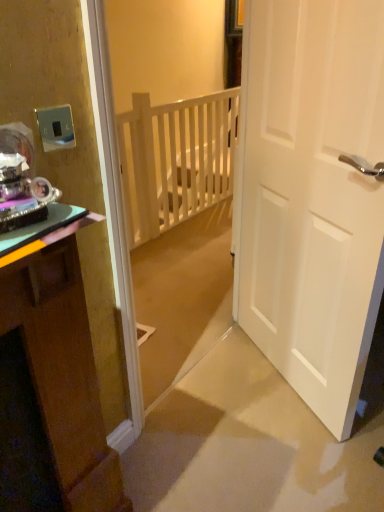
Question: Should I look upward or downward to see white wooden balustrade at center?

Choices:
 (A) down
 (B) up

Answer: (B)

Question: From the image's perspective, is metallic silver switch at upper left below white wooden balustrade at center?

Choices:
 (A) no
 (B) yes

Answer: (B)

Question: Is white wooden balustrade at center at the back of metallic silver switch at upper left?

Choices:
 (A) no
 (B) yes

Answer: (A)

Question: Can white wooden balustrade at center be found inside metallic silver switch at upper left?

Choices:
 (A) no
 (B) yes

Answer: (A)

Question: From a real-world perspective, is metallic silver switch at upper left located higher than white wooden balustrade at center?

Choices:
 (A) yes
 (B) no

Answer: (A)

Question: Considering the relative sizes of metallic silver switch at upper left and white wooden balustrade at center in the image provided, is metallic silver switch at upper left shorter than white wooden balustrade at center?

Choices:
 (A) no
 (B) yes

Answer: (B)

Question: Is metallic silver switch at upper left at the left side of white wooden balustrade at center?

Choices:
 (A) yes
 (B) no

Answer: (A)

Question: From a real-world perspective, is white wooden balustrade at center on metallic silver switch at upper left?

Choices:
 (A) no
 (B) yes

Answer: (A)

Question: Is white wooden balustrade at center not close to metallic silver switch at upper left?

Choices:
 (A) yes
 (B) no

Answer: (A)

Question: Does white wooden balustrade at center touch metallic silver switch at upper left?

Choices:
 (A) yes
 (B) no

Answer: (B)

Question: Does white wooden balustrade at center have a smaller size compared to metallic silver switch at upper left?

Choices:
 (A) no
 (B) yes

Answer: (A)

Question: Does white wooden balustrade at center come in front of metallic silver switch at upper left?

Choices:
 (A) yes
 (B) no

Answer: (B)

Question: From the image's perspective, is white wooden balustrade at center above metallic silver switch at upper left?

Choices:
 (A) yes
 (B) no

Answer: (A)

Question: Can you confirm if green glossy cabinet at left is wider than white wooden balustrade at center?

Choices:
 (A) no
 (B) yes

Answer: (B)